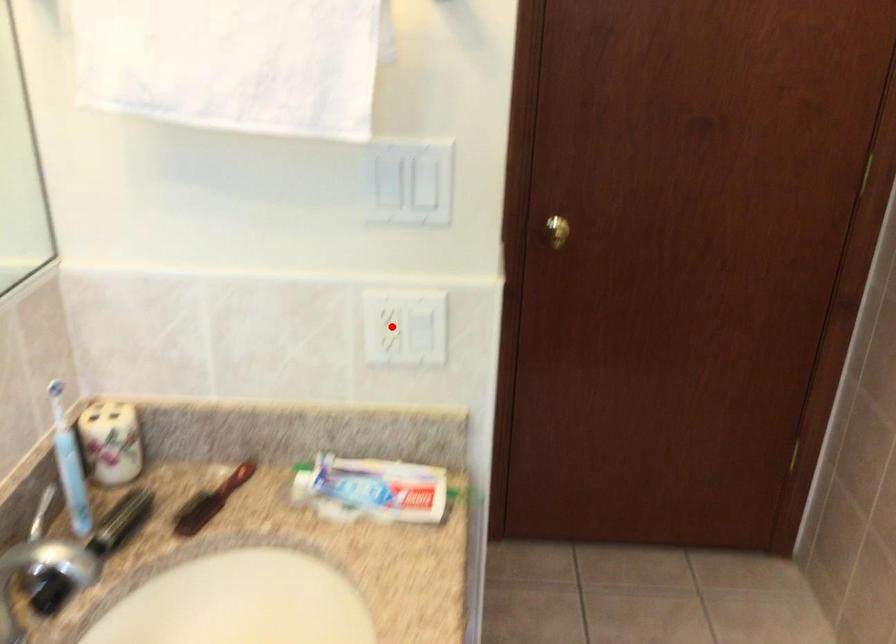
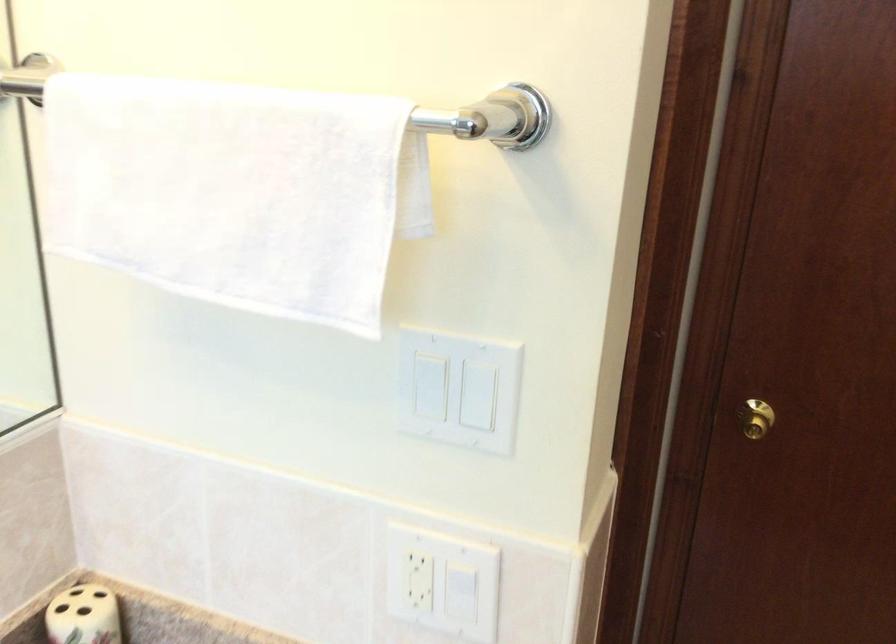
Question: I am providing you with two images of the same scene from different viewpoints. Image1 has a red point marked. In image2, the corresponding 3D location appears at what relative position? Reply with the corresponding letter.

Choices:
 (A) Closer
 (B) Farther

Answer: (A)